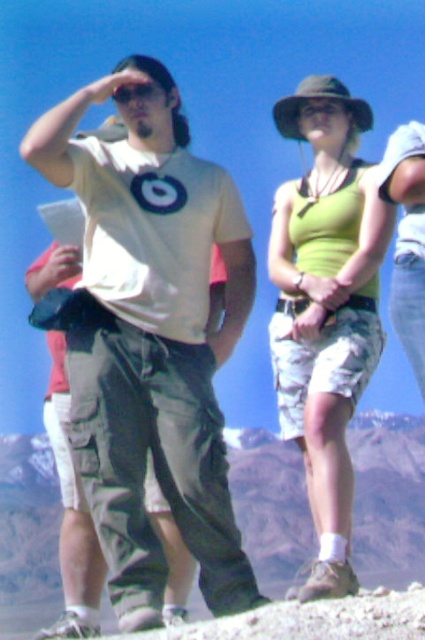
Based on the scene description, which object is taller between the gray rock formation at center and the matte black sunglasses at upper left?

The gray rock formation at center is much taller than the matte black sunglasses at upper left.

In the scene shown: Based on the scene description, which object is bigger between the matte khaki pants at center and the matte black sunglasses at upper left?

The matte khaki pants at center is larger in size than the matte black sunglasses at upper left according to the description.

You are a photographer trying to capture a group shot of the two people in the scene. The man in the light T shirt with a target design on the left and the woman in the green fabric tank top at center. The camera you are using has a maximum focus range of 20 meters. Can you take a clear photo of both of them at the same time?

The man in the light T shirt with a target design on the left and the woman in the green fabric tank top at center are 22.80 meters apart. Since the camera can only focus up to 20 meters, the distance between them exceeds the camera s maximum focus range. Therefore, you cannot take a clear photo of both at the same time.